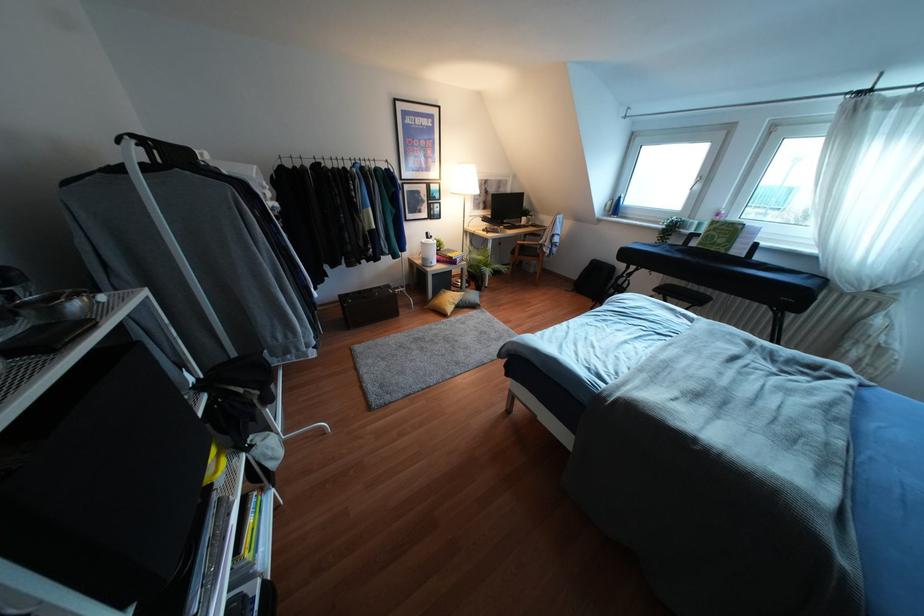
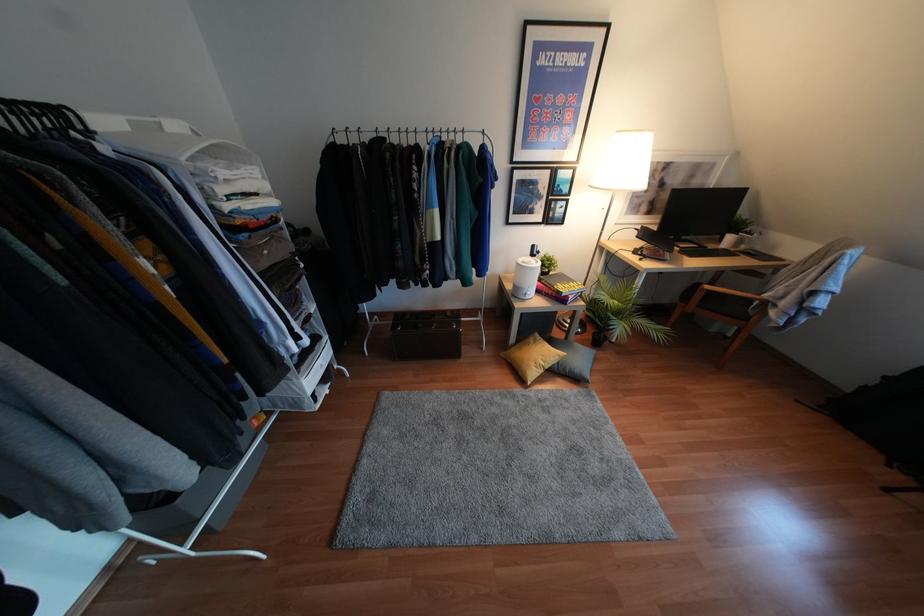
Where in the second image is the point corresponding to point 481,283 from the first image?

(604, 336)